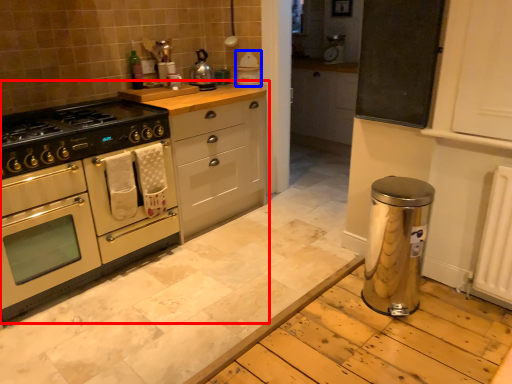
Question: Among these objects, which one is nearest to the camera, cabinetry (highlighted by a red box) or appliance (highlighted by a blue box)?

Choices:
 (A) cabinetry
 (B) appliance

Answer: (A)